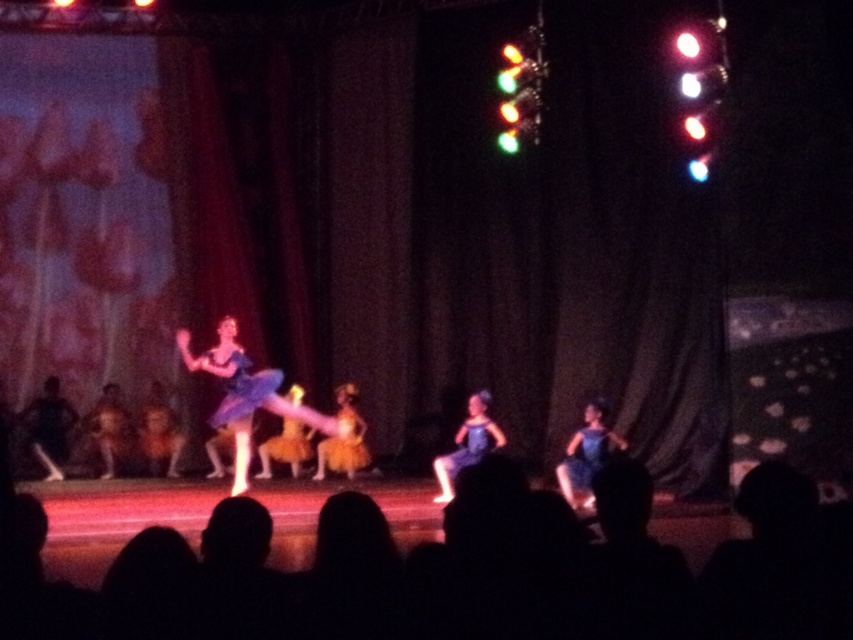
Is matte blue dress at center bigger than matte black dress at center?

Yes.

Is matte blue dress at center to the right of matte black dress at center from the viewer's perspective?

Indeed, matte blue dress at center is positioned on the right side of matte black dress at center.

Who is more forward, [187,339] or [56,410]?

Positioned in front is point [187,339].

Locate an element on the screen. The height and width of the screenshot is (640, 853). matte blue dress at center is located at coordinates (247, 396).